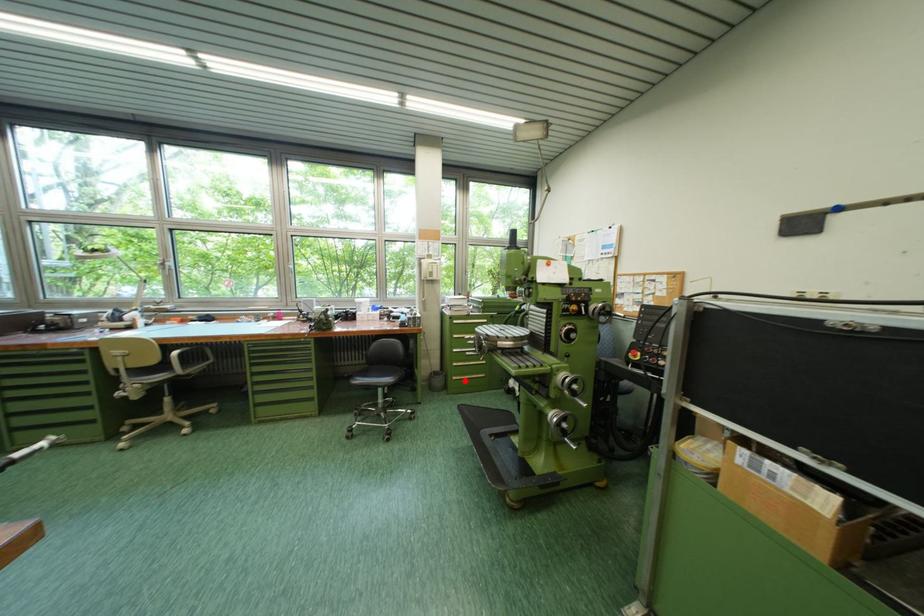
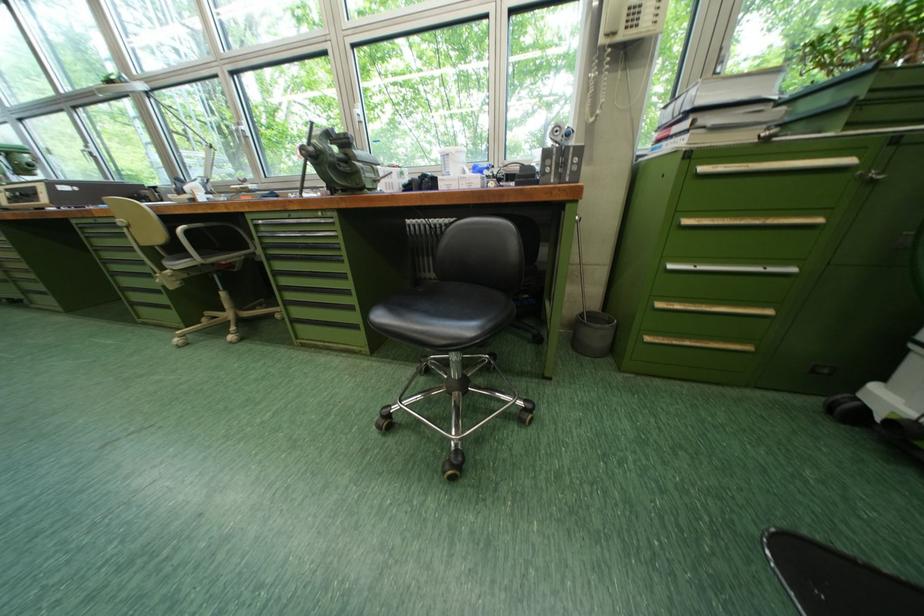
Locate, in the second image, the point that corresponds to the highlighted location in the first image.

(659, 341)